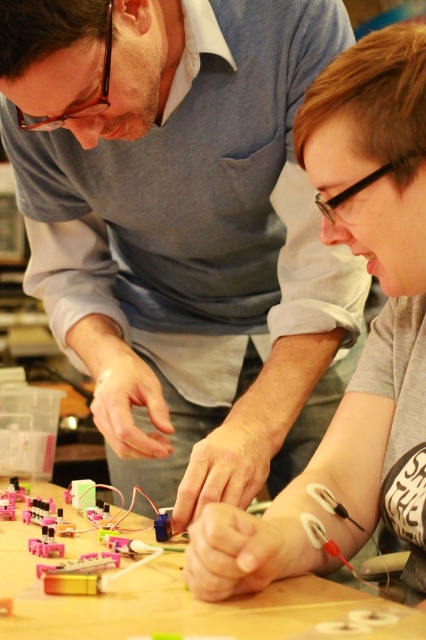
Which is more to the left, matte gray sweater at upper left or gray matte shirt at center?

From the viewer's perspective, matte gray sweater at upper left appears more on the left side.

Is point (262, 272) closer to camera compared to point (273, 531)?

That is False.

Find the location of `matte gray sweater at upper left`. matte gray sweater at upper left is located at coordinates (183, 230).